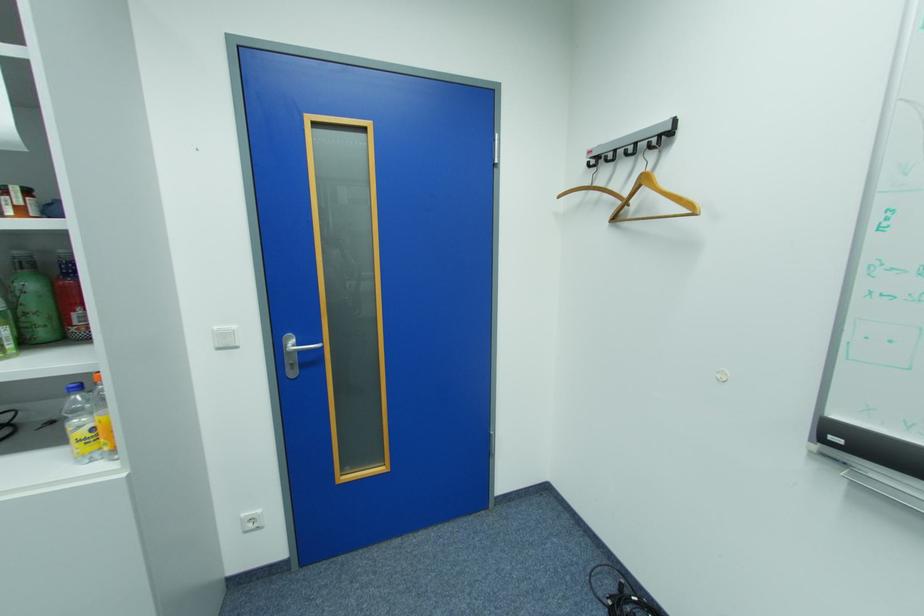
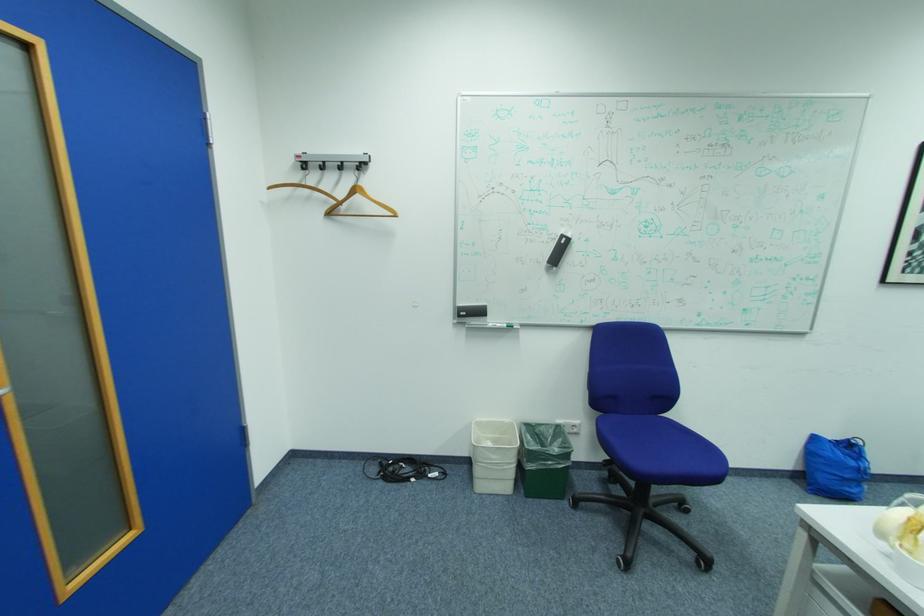
Where in the second image is the point corresponding to (651,191) from the first image?

(366, 197)